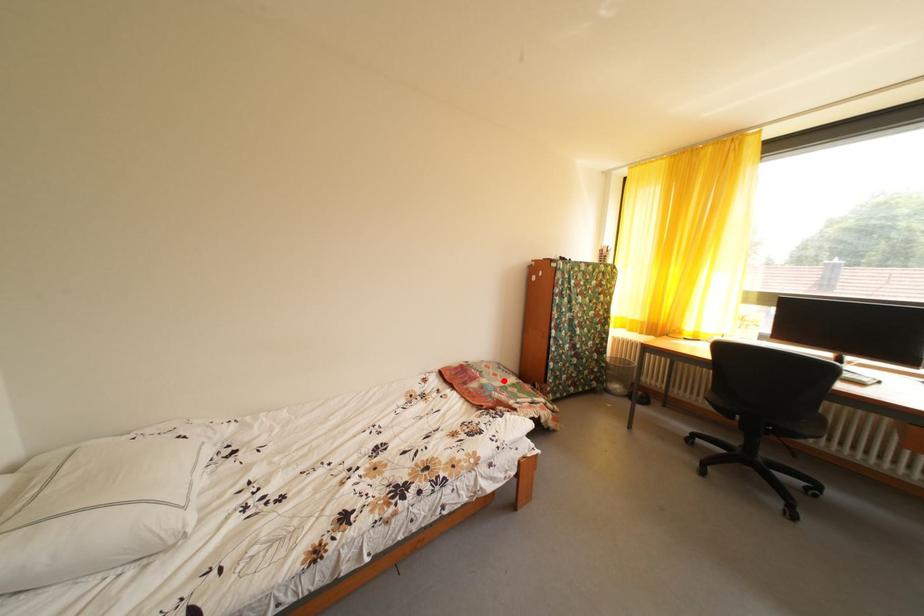
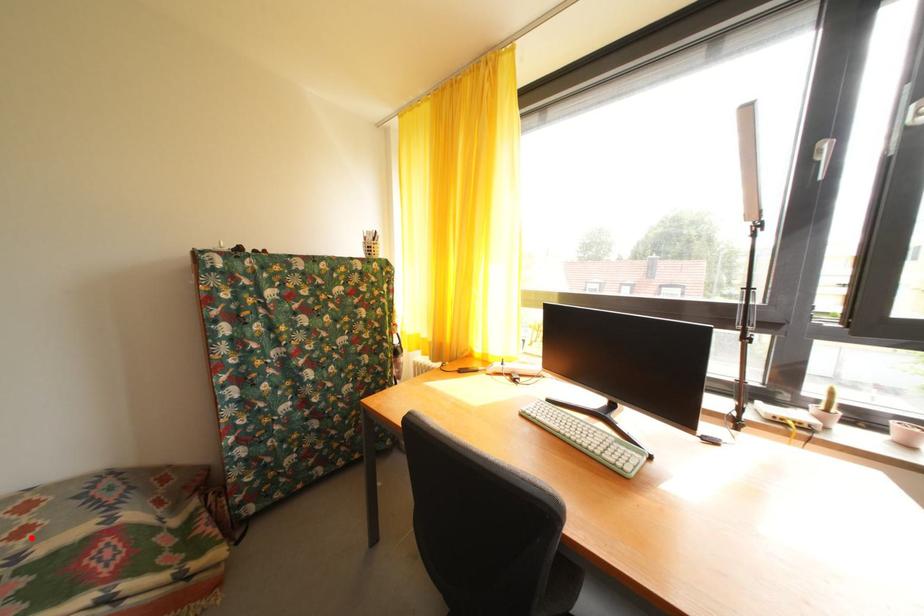
I am providing you with two images of the same scene from different viewpoints. A red point is marked on the first image and another point is marked on the second image. Does the point marked in image1 correspond to the same location as the one in image2?

Yes